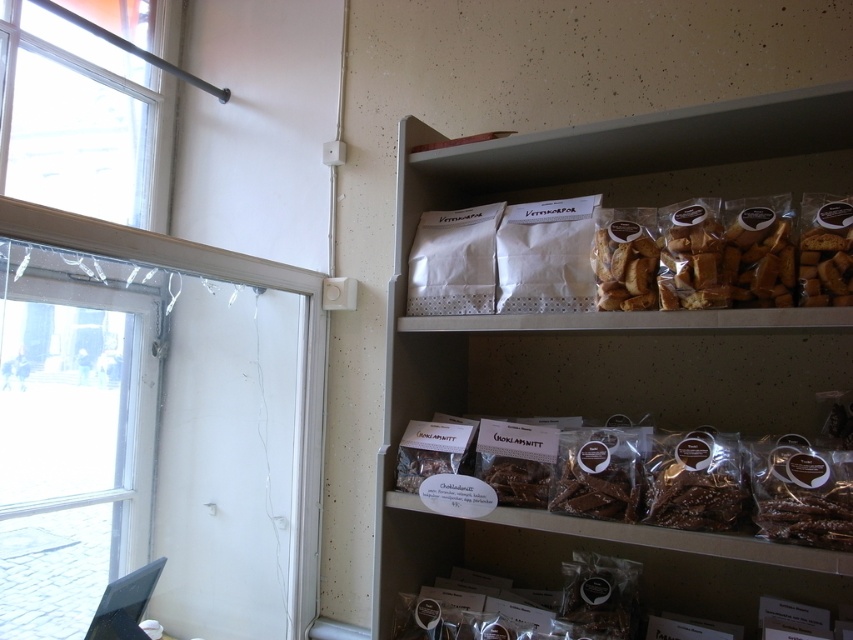
You are a customer in the bakery and want to locate the matte white shelf at upper right. According to the coordinates provided, where should you look in the image?

The matte white shelf at upper right is located at coordinates point (616, 333) in the image.

You are standing in the bakery and want to see the items on the top shelf. There is a clear glass window at left located at point (73, 438). Can you look through the clear glass window at left to view the items on the top shelf?

Yes, the clear glass window at left located at point (73, 438) allows viewing of the items on the top shelf as it is made of clear glass.

Looking at this image, you are standing in front of the bakery shelves and want to check the time on the clear glass window at left. Where should you look?

The clear glass window at left is located at the coordinates point (73, 438), so you should look there to check the time.